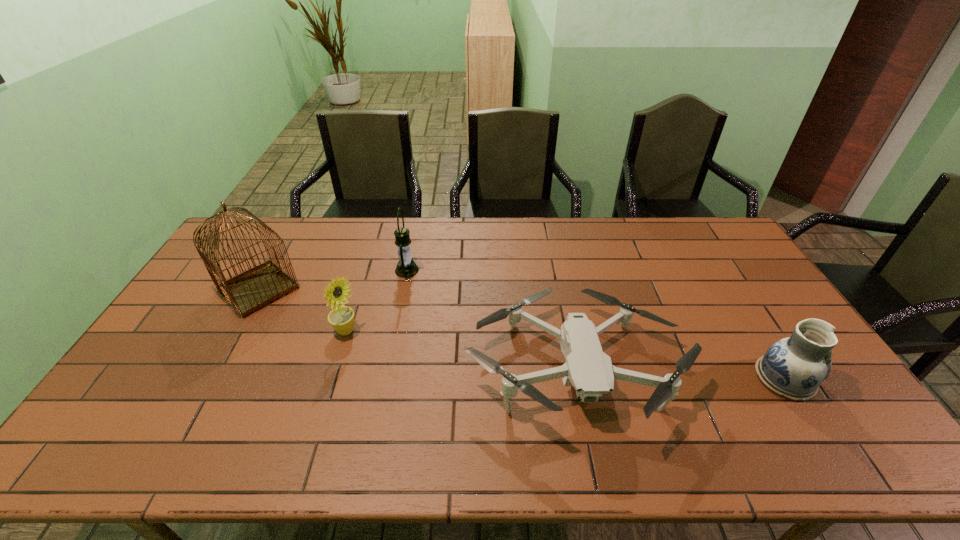
What are the coordinates of `the leftmost object` in the screenshot? It's located at (256, 288).

At what (x,y) coordinates should I click in order to perform the action: click on birdcage. Please return your answer as a coordinate pair (x, y). Looking at the image, I should click on (256, 288).

Find the location of a particular element. This screenshot has height=540, width=960. the third object from right to left is located at coordinates (406, 267).

The image size is (960, 540). What are the coordinates of `lantern` in the screenshot? It's located at pyautogui.click(x=406, y=267).

At what (x,y) coordinates should I click in order to perform the action: click on sunflower. Please return your answer as a coordinate pair (x, y). Looking at the image, I should click on (341, 318).

You are a GUI agent. You are given a task and a screenshot of the screen. Output one action in this format:
    pyautogui.click(x=<x>, y=<y>)
    Task: Click on the rightmost object
    The width and height of the screenshot is (960, 540).
    Given the screenshot: What is the action you would take?
    pyautogui.click(x=794, y=367)

Where is `the second object from right to left`? the second object from right to left is located at coordinates (588, 369).

I want to click on drone, so click(588, 369).

This screenshot has height=540, width=960. What are the coordinates of `free space located 0.210m on the right of the birdcage` in the screenshot? It's located at (364, 289).

At what (x,y) coordinates should I click in order to perform the action: click on vacant space located on the side where the third object from left to right emits light. Please return your answer as a coordinate pair (x, y). The width and height of the screenshot is (960, 540). Looking at the image, I should click on (486, 270).